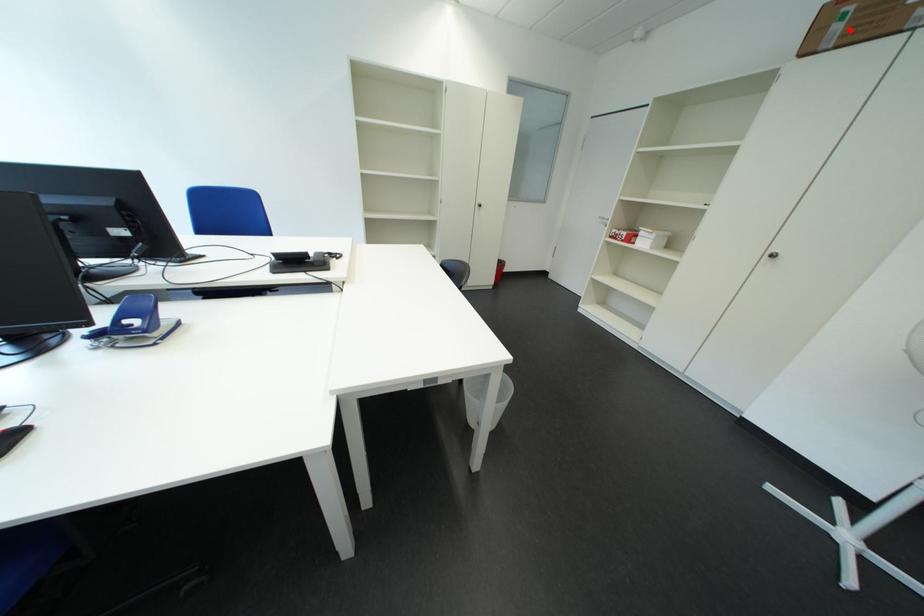
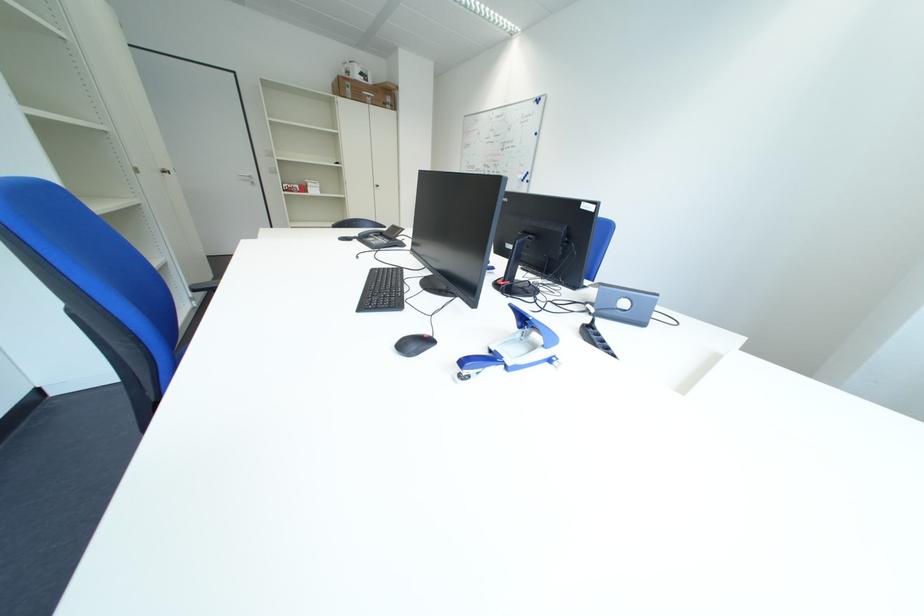
Find the pixel in the second image that matches the highlighted location in the first image.

(360, 92)